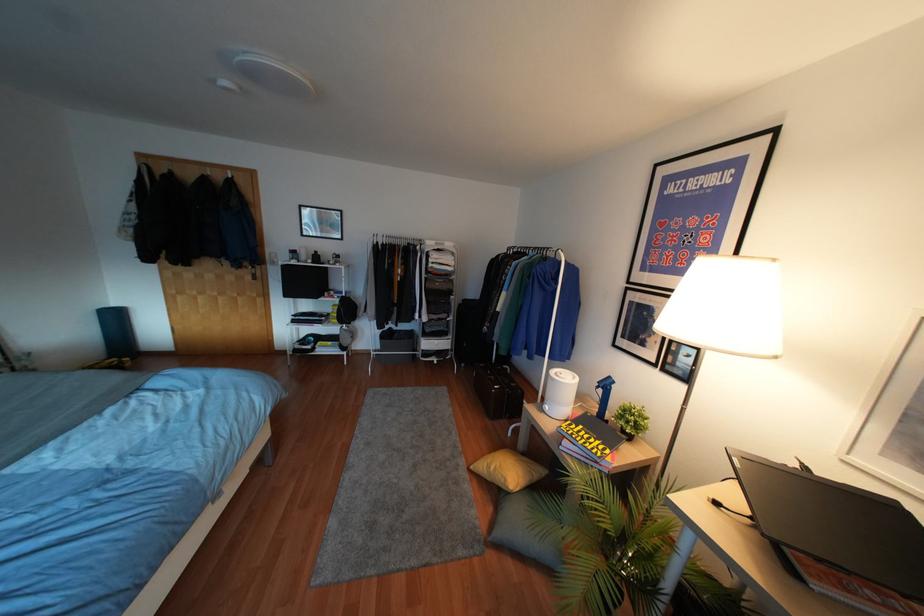
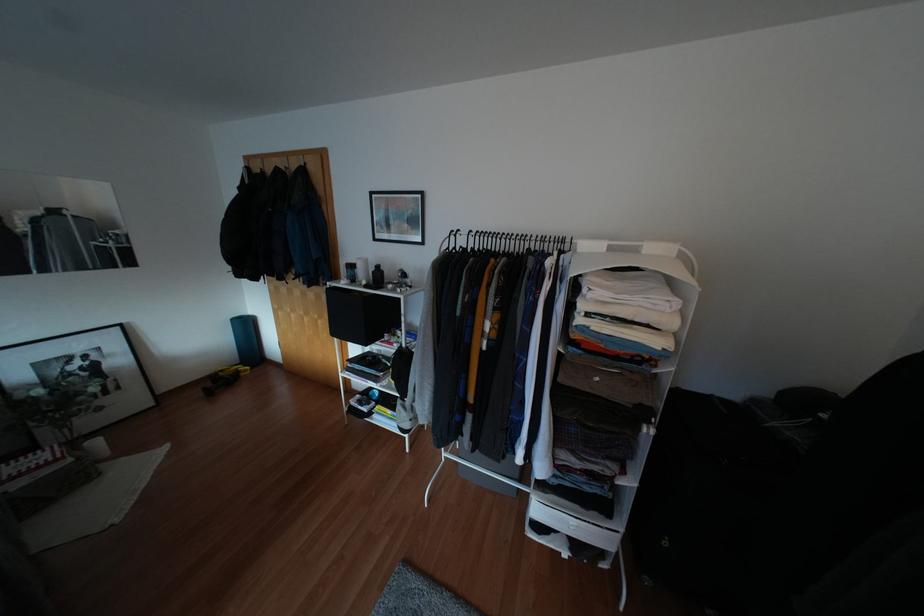
Where in the second image is the point corresponding to pixel 309 261 from the first image?

(362, 282)